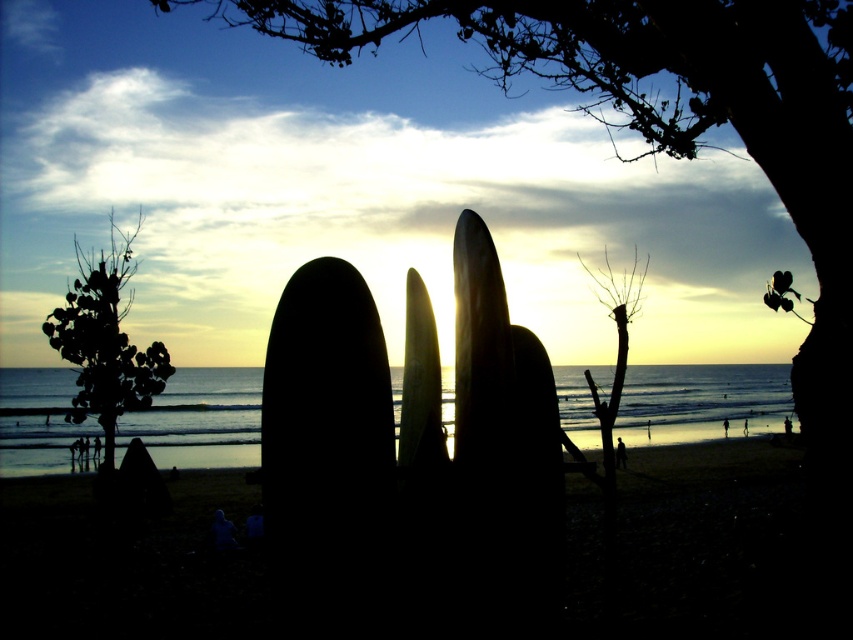
In the scene shown: You are a photographer wanting to capture the sunset with both the black matte surfboard at center and the green leafy tree at left in the frame. Which object will appear taller in the photo?

The green leafy tree at left will appear taller in the photo because the black matte surfboard at center has a lesser height compared to it.

You are standing on the beach and want to take a photo of the dark green leafy tree at center. Where should you position yourself to capture it in the frame?

You should position yourself at point (x=668, y=112) to capture the dark green leafy tree at center in the frame.

You are standing on the beach looking towards the sunset. There are two points marked on the sand, one at coordinates point (345, 42) and the other at point (416, 445). Which point is closer to the horizon where the sun is setting?

Point (416, 445) is closer to the horizon where the sun is setting because it is in front of point (345, 42).